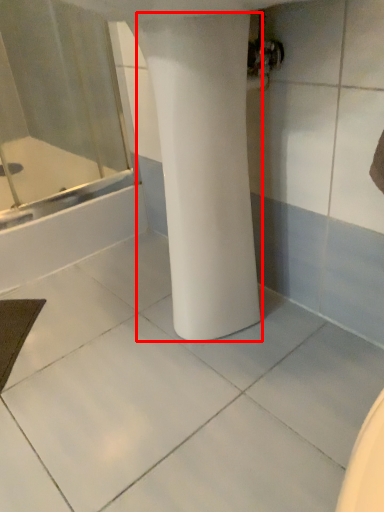
Question: From the image, what is the correct spatial relationship of pillar (annotated by the red box) in relation to bathtub?

Choices:
 (A) right
 (B) left

Answer: (A)